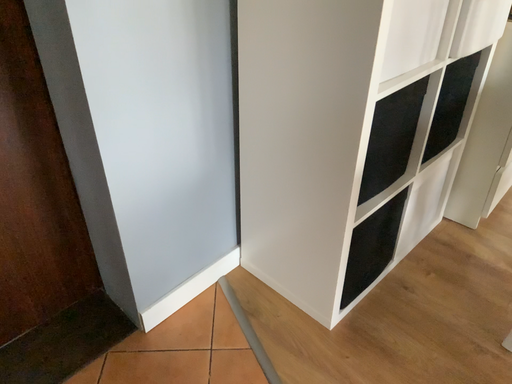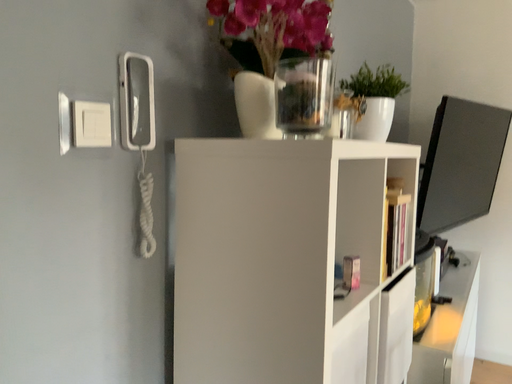
Question: Which way did the camera rotate in the video?

Choices:
 (A) rotated downward
 (B) rotated upward

Answer: (B)